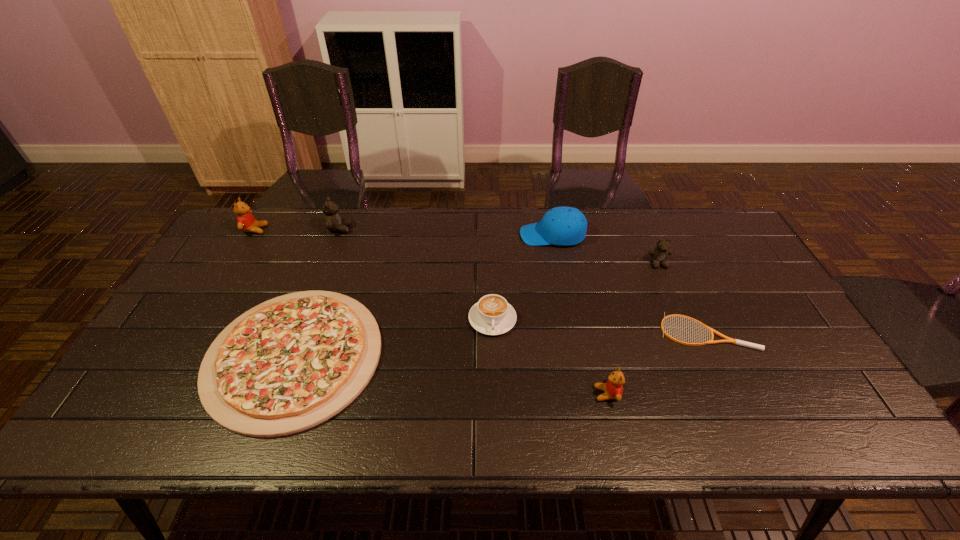
Locate which teddy bear is the third closest to the smaller red teddy bear. Please provide its 2D coordinates. Your answer should be formatted as a tuple, i.e. [(x, y)], where the tuple contains the x and y coordinates of a point satisfying the conditions above.

[(246, 222)]

Image resolution: width=960 pixels, height=540 pixels. Identify the location of free point that satisfies the following two spatial constraints: 1. on the side of the beige tennis racket with the handle; 2. on the left side of the fourth object from left to right. (492, 332).

Locate an element on the screen. This screenshot has width=960, height=540. vacant space that satisfies the following two spatial constraints: 1. on the face of the third farthest teddy bear; 2. on the front-facing side of the third teddy bear from left to right is located at coordinates (715, 394).

Where is `vacant point that satisfies the following two spatial constraints: 1. on the front-facing side of the cap; 2. on the side of the fourth object from left to right with the handle`? The height and width of the screenshot is (540, 960). vacant point that satisfies the following two spatial constraints: 1. on the front-facing side of the cap; 2. on the side of the fourth object from left to right with the handle is located at coordinates (568, 319).